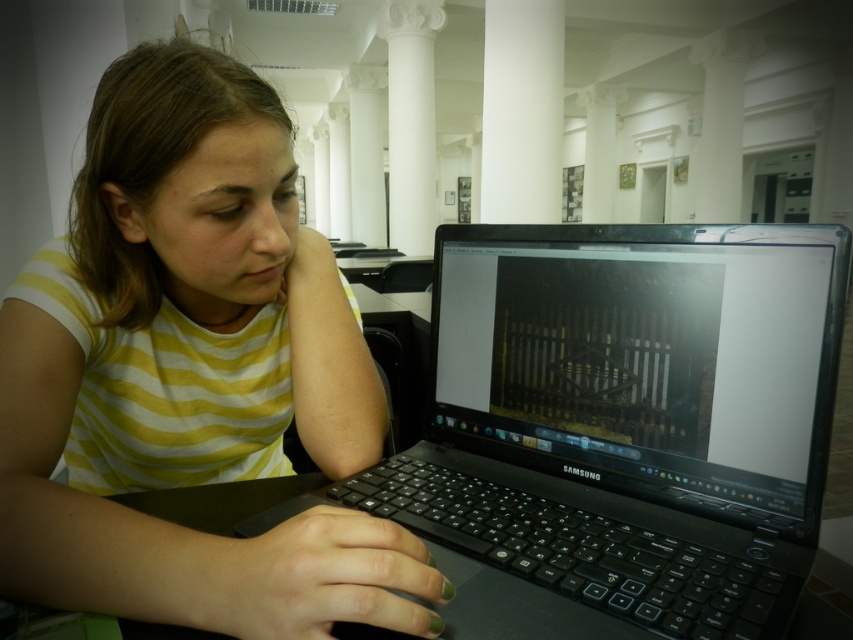
Question: Is black plastic laptop at center below white smooth pillar at center?

Choices:
 (A) no
 (B) yes

Answer: (B)

Question: Based on their relative distances, which object is farther from the black plastic table at center?

Choices:
 (A) black plastic laptop at center
 (B) black glossy laptop at center
 (C) white marble column at center
 (D) yellow striped shirt at center

Answer: (C)

Question: Among these points, which one is farthest from the camera?

Choices:
 (A) (664, 259)
 (B) (517, 170)

Answer: (B)

Question: Where is yellow striped shirt at center located in relation to white marble column at center in the image?

Choices:
 (A) below
 (B) above

Answer: (A)

Question: Which object appears closest to the camera in this image?

Choices:
 (A) black plastic laptop at center
 (B) yellow striped shirt at center

Answer: (B)

Question: Can you confirm if yellow striped shirt at center is positioned below white smooth pillar at center?

Choices:
 (A) yes
 (B) no

Answer: (A)